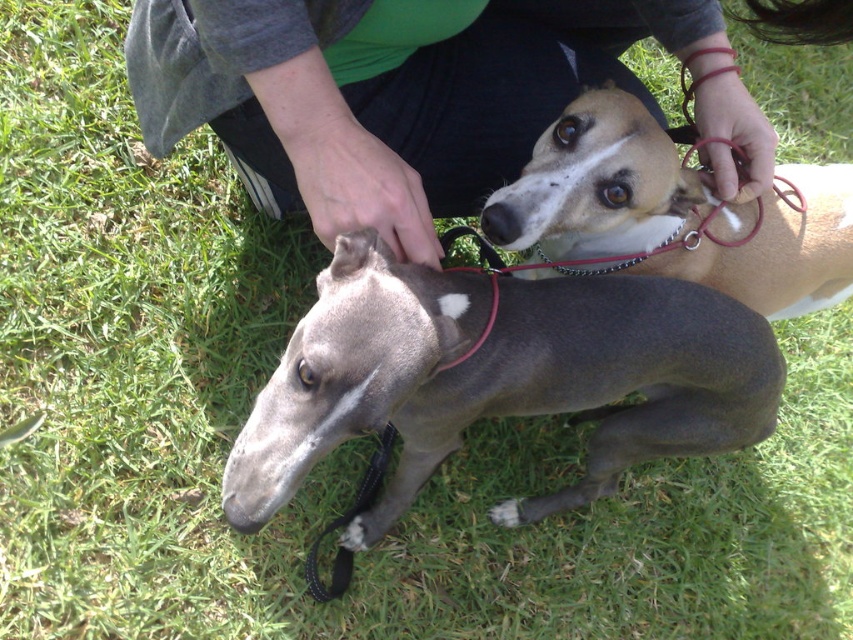
Is point (653, 300) closer to camera compared to point (734, 120)?

Yes, point (653, 300) is in front of point (734, 120).

Who is more forward, [517,508] or [755,134]?

Point [755,134]

Between point (337, 324) and point (482, 65), which one is positioned in front?

Point (337, 324) is in front.

Identify the location of smooth gray dog at center. coord(497,378).

Is smooth gray dog at center to the left of brown smooth dog at center from the viewer's perspective?

Correct, you'll find smooth gray dog at center to the left of brown smooth dog at center.

Looking at this image, between smooth gray dog at center and brown smooth dog at center, which one is positioned higher?

brown smooth dog at center

Which is in front, point (613, 442) or point (566, 109)?

Point (566, 109) is in front.

Where is `smooth gray dog at center`? The width and height of the screenshot is (853, 640). smooth gray dog at center is located at coordinates (497, 378).

Is green fabric shirt at upper center closer to the viewer compared to brown smooth dog at center?

Yes, green fabric shirt at upper center is in front of brown smooth dog at center.

Can you confirm if green fabric shirt at upper center is positioned to the left of brown smooth dog at center?

Indeed, green fabric shirt at upper center is positioned on the left side of brown smooth dog at center.

Between point (349, 164) and point (688, 272), which one is positioned behind?

The point (688, 272) is behind.

This screenshot has width=853, height=640. I want to click on green fabric shirt at upper center, so click(x=381, y=97).